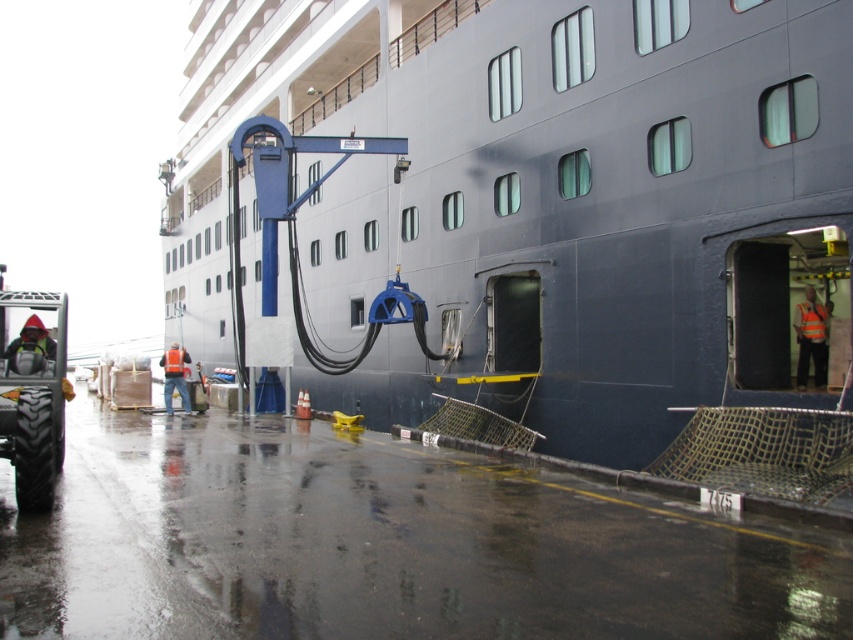
Question: Is dark blue metal cruise ship at center thinner than brushed metal tractor at lower left?

Choices:
 (A) yes
 (B) no

Answer: (B)

Question: Which point is closer to the camera?

Choices:
 (A) click(x=218, y=102)
 (B) click(x=27, y=412)

Answer: (B)

Question: Can you confirm if dark blue metal cruise ship at center is positioned above brushed metal tractor at lower left?

Choices:
 (A) yes
 (B) no

Answer: (A)

Question: Which of the following is the closest to the observer?

Choices:
 (A) (6, 406)
 (B) (525, 154)

Answer: (A)

Question: Where is dark blue metal cruise ship at center located in relation to brushed metal tractor at lower left in the image?

Choices:
 (A) below
 (B) above

Answer: (B)